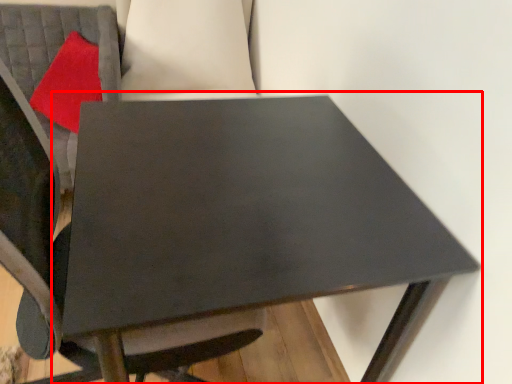
Question: Observing the image, what is the correct spatial positioning of table (annotated by the red box) in reference to pillow?

Choices:
 (A) left
 (B) right

Answer: (B)